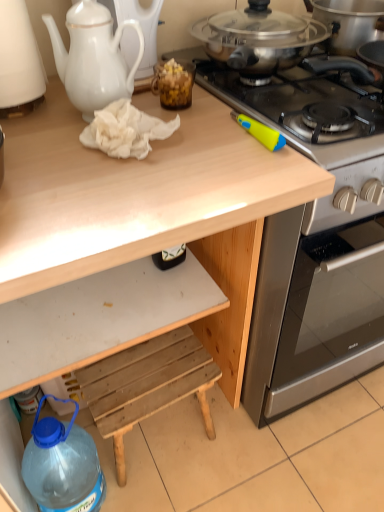
Identify the location of vacant space to the right of translucent brown jar at upper center. Image resolution: width=384 pixels, height=512 pixels. (213, 106).